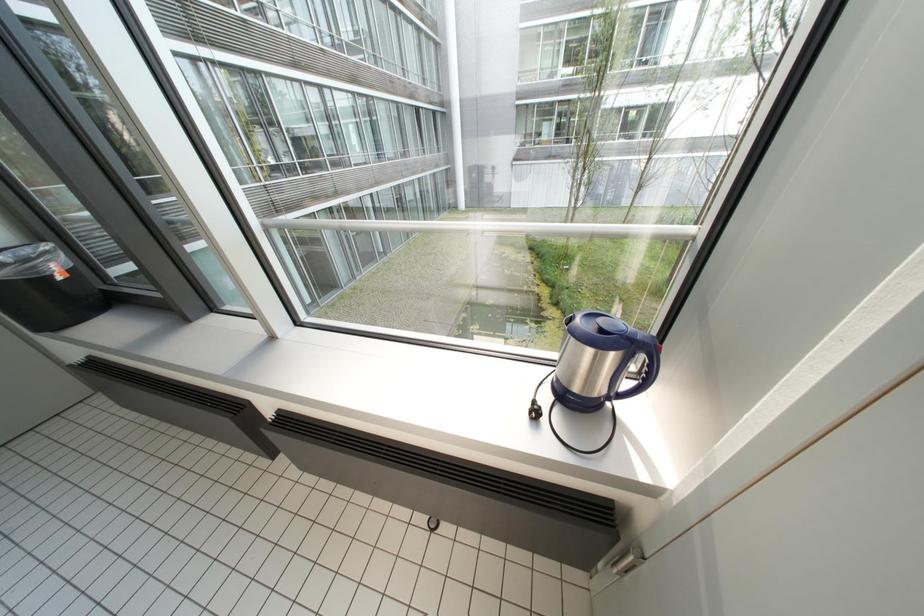
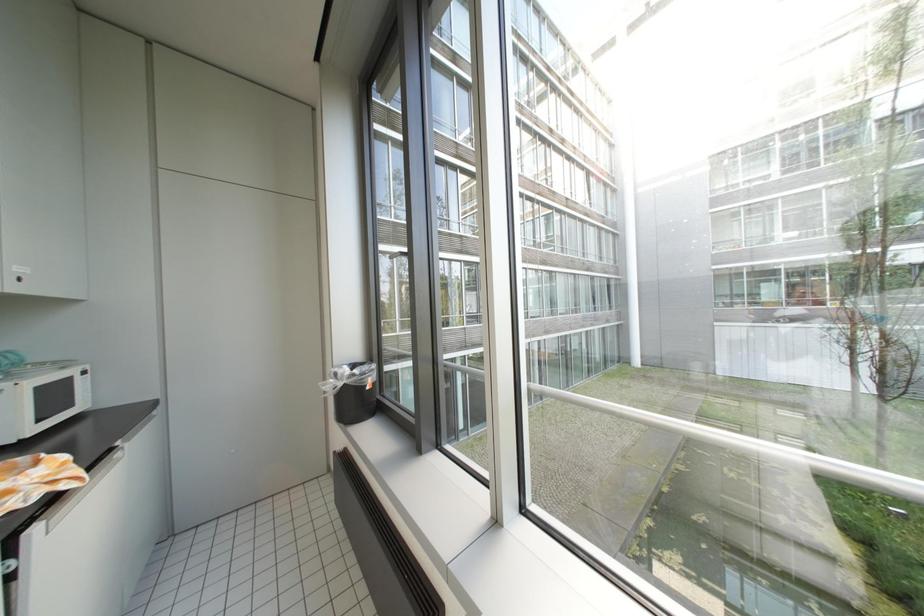
The first image is from the beginning of the video and the second image is from the end. How did the camera likely rotate when shooting the video?

The camera rotated toward left-up.